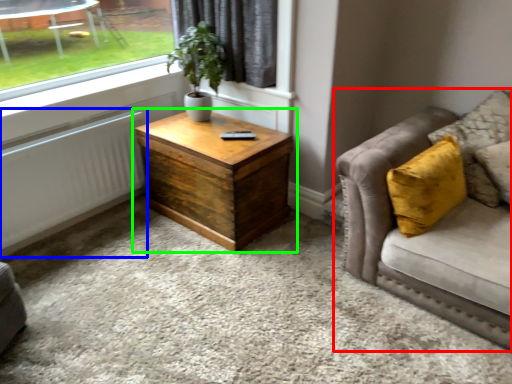
Question: Which is nearer to the studio couch (highlighted by a red box)? radiator (highlighted by a blue box) or coffee table (highlighted by a green box).

Choices:
 (A) radiator
 (B) coffee table

Answer: (B)